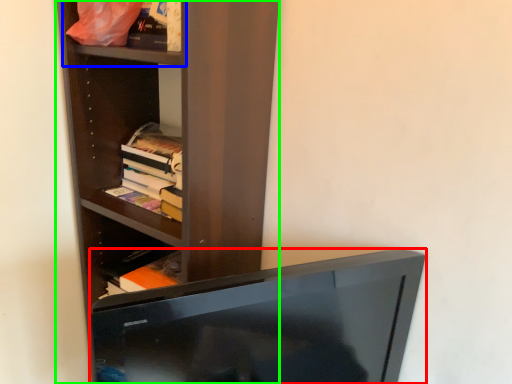
Question: Which object is the farthest from television (highlighted by a red box)? Choose among these: cabinet (highlighted by a blue box) or shelf (highlighted by a green box).

Choices:
 (A) cabinet
 (B) shelf

Answer: (A)